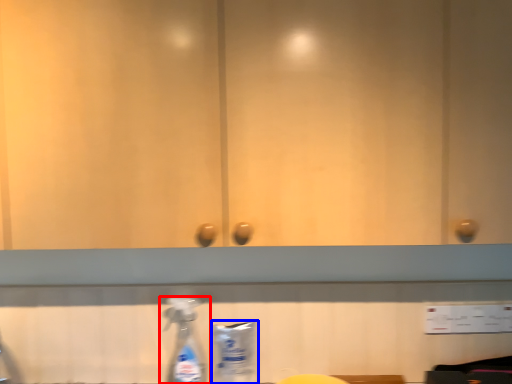
Question: Which object appears closest to the camera in this image, bottle (highlighted by a red box) or cleaning product (highlighted by a blue box)?

Choices:
 (A) bottle
 (B) cleaning product

Answer: (A)